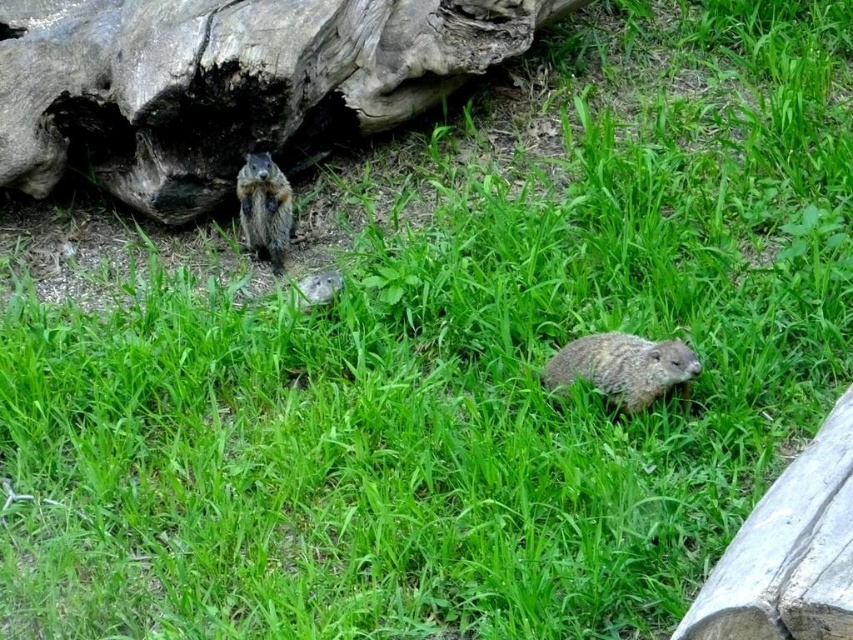
Is brown fuzzy beaver at lower center taller than brown furry squirrel at center?

No.

What are the coordinates of `brown fuzzy beaver at lower center` in the screenshot? It's located at (621, 368).

Describe the element at coordinates (621, 368) in the screenshot. Image resolution: width=853 pixels, height=640 pixels. I see `brown fuzzy beaver at lower center` at that location.

Locate an element on the screen. This screenshot has width=853, height=640. brown fuzzy beaver at lower center is located at coordinates (621, 368).

How much distance is there between weathered wood log at upper left and brown furry squirrel at center?

weathered wood log at upper left and brown furry squirrel at center are 32.38 centimeters apart from each other.

Who is taller, weathered wood log at upper left or brown furry squirrel at center?

weathered wood log at upper left is taller.

Find the location of a particular element. This screenshot has height=640, width=853. weathered wood log at upper left is located at coordinates (225, 83).

Image resolution: width=853 pixels, height=640 pixels. Identify the location of weathered wood log at upper left. (225, 83).

Who is higher up, weathered wood log at upper left or brown fuzzy beaver at lower center?

weathered wood log at upper left is above.

Where is `weathered wood log at upper left`? Image resolution: width=853 pixels, height=640 pixels. weathered wood log at upper left is located at coordinates (225, 83).

The height and width of the screenshot is (640, 853). I want to click on weathered wood log at upper left, so click(225, 83).